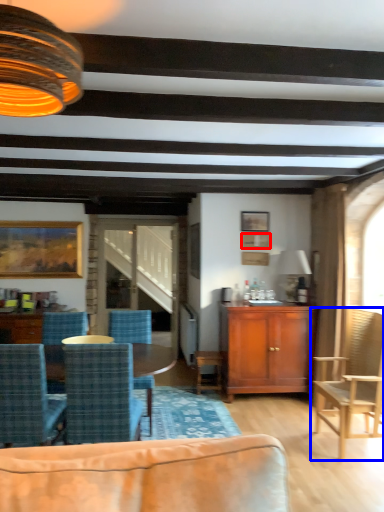
Question: Which point is closer to the camera, picture frame (highlighted by a red box) or chair (highlighted by a blue box)?

Choices:
 (A) picture frame
 (B) chair

Answer: (B)